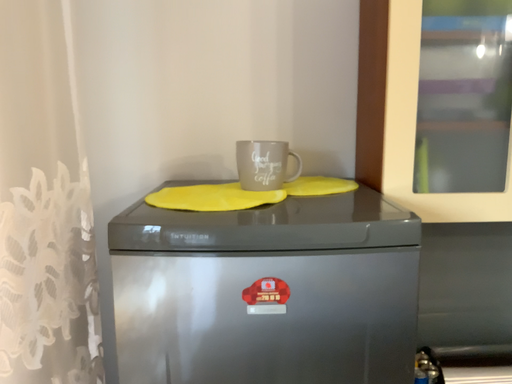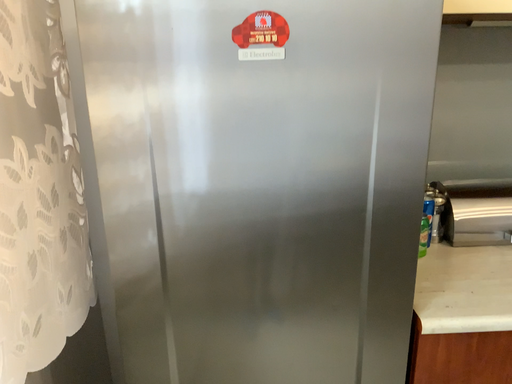
Question: Which way did the camera rotate in the video?

Choices:
 (A) rotated upward
 (B) rotated downward

Answer: (B)